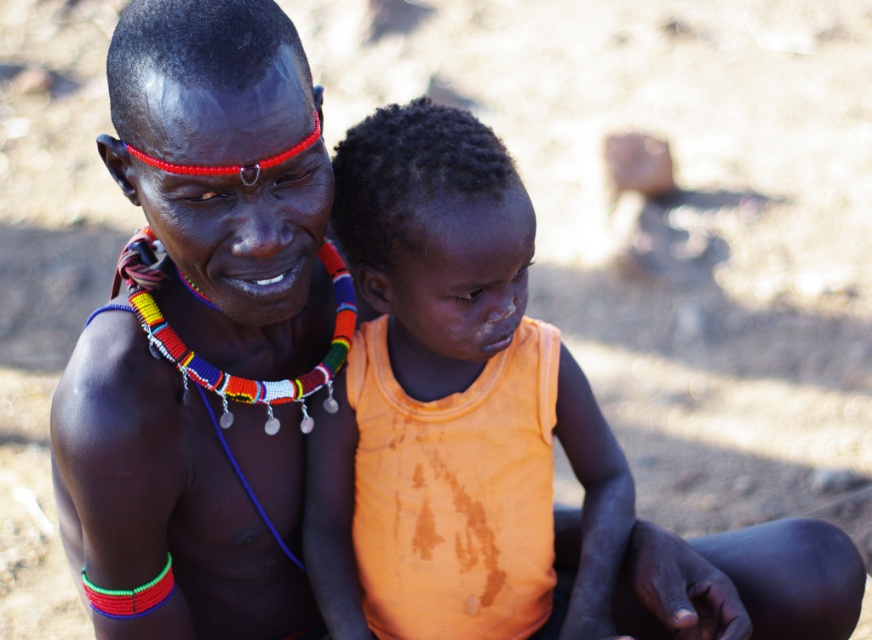
Based on the scene description, if you were looking at the image, which object would you see first between the matte black face paint at center and the orange fabric shirt at center?

The matte black face paint at center is located above the orange fabric shirt at center, so you would see the matte black face paint at center first since it is positioned higher in the visual field.

You are a photographer taking a portrait of the matte black face paint at center and the orange fabric shirt at center. Which object will appear larger in your photo?

The matte black face paint at center will appear larger in the photo because it is closer to the viewer than the orange fabric shirt at center.

You are taking a photo of two points in the scene. The first point is labeled as point (310, 368) and the second is point (519, 188). Which point is closer to the camera?

Point (310, 368) is further to the camera than point (519, 188), so the closer point to the camera is point (519, 188).